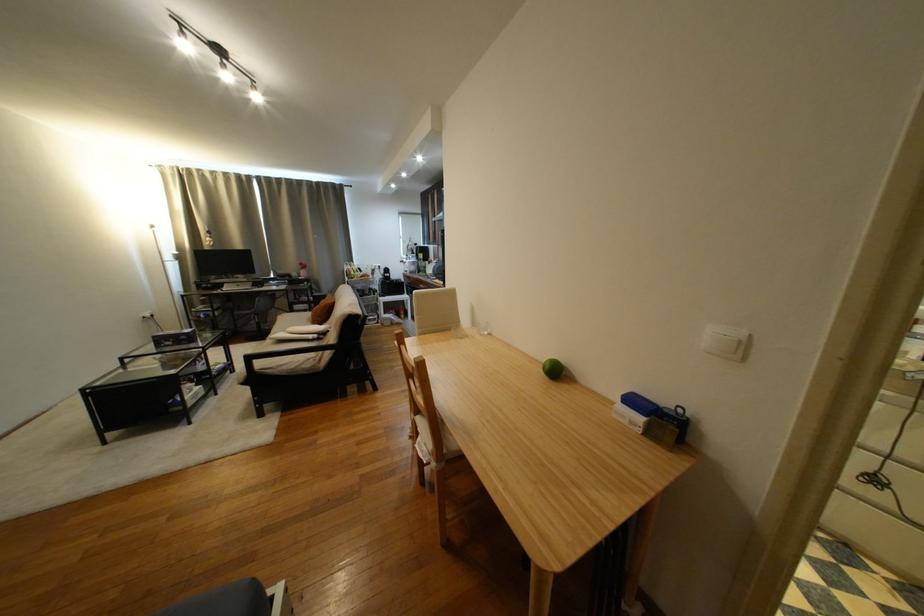
What are the coordinates of `sofa sitting surface` in the screenshot? It's located at (292, 334).